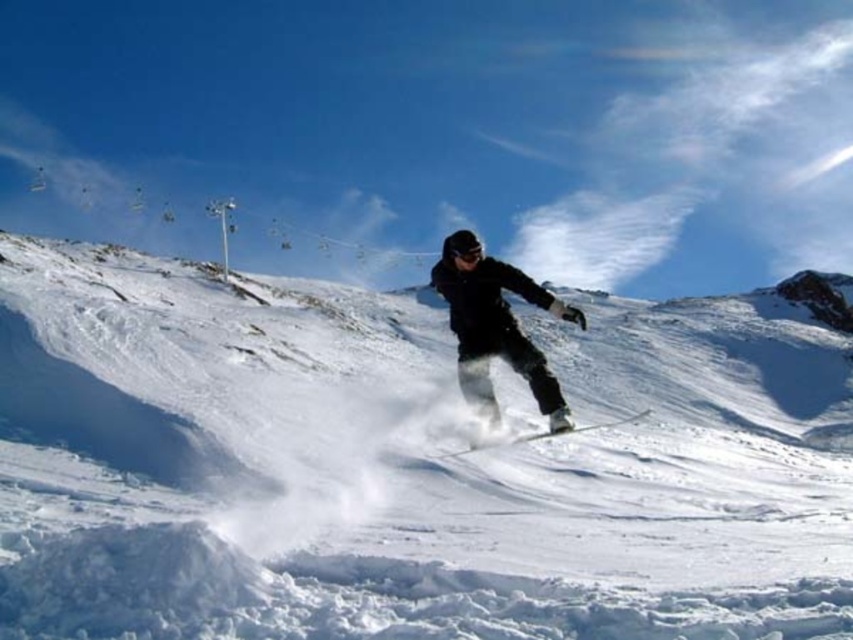
You are a drone operator trying to capture the black matte snowboarder at center. The drone is currently at point 0.5, 0.6. What direction should the drone move to get closer to the snowboarder?

The black matte snowboarder at center is at point (496, 326). The drone is at (511, 320). To get closer, the drone should move slightly to the right and downward because the snowboarder is to the right and below the drone.

You are a photographer trying to capture the scene of the white fluffy snow at center and the black matte snowboarder at center. If you want to focus on the snowboarder, which object should you zoom in on more to ensure it fills the frame?

The white fluffy snow at center is wider than the black matte snowboarder at center, so to focus on the snowboarder, you should zoom in on the black matte snowboarder at center to make it fill the frame more.

You are a drone operator tasked with capturing aerial footage of the scene. The white fluffy snow at center and white matte ski at center are both important subjects. What is the minimum distance your drone must maintain to ensure both are in frame simultaneously?

The minimum distance your drone must maintain is 60.02 meters to ensure both the white fluffy snow at center and white matte ski at center are in frame simultaneously.